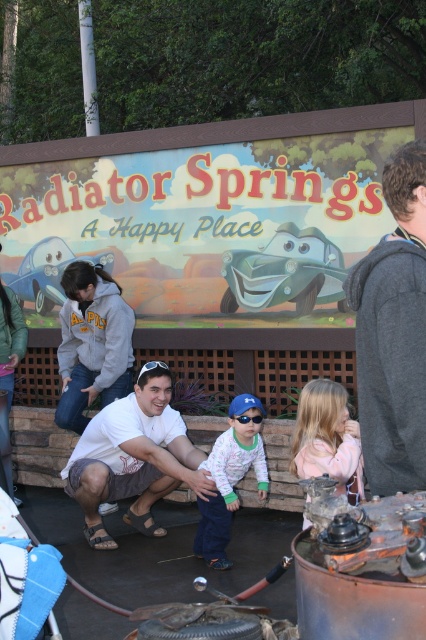
Question: Which object appears closest to the camera in this image?

Choices:
 (A) white matte shirt at center
 (B) white fleece jacket at center
 (C) dark gray sweater at upper right

Answer: (C)

Question: Can you confirm if dark gray sweater at upper right is bigger than white matte shirt at center?

Choices:
 (A) yes
 (B) no

Answer: (B)

Question: Among these objects, which one is farthest from the camera?

Choices:
 (A) white fleece jacket at center
 (B) white matte shirt at center
 (C) dark gray sweater at upper right

Answer: (B)

Question: Can you confirm if white matte shirt at center is wider than white fleece jacket at center?

Choices:
 (A) yes
 (B) no

Answer: (A)

Question: Can you confirm if dark gray sweater at upper right is bigger than white fleece jacket at center?

Choices:
 (A) yes
 (B) no

Answer: (B)

Question: Which of the following is the closest to the observer?

Choices:
 (A) (261, 465)
 (B) (86, 516)
 (C) (379, 380)

Answer: (C)